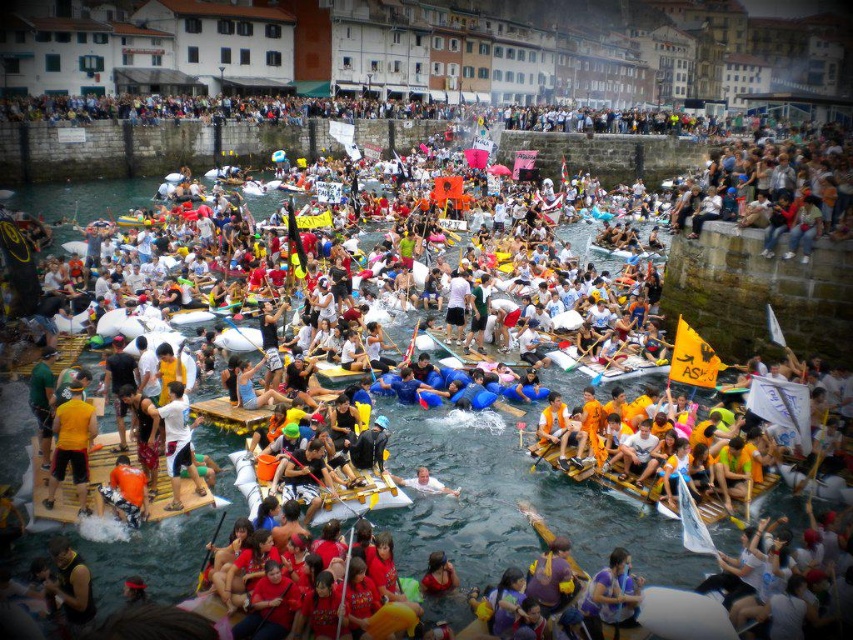
Is white matte shirt at center shorter than white fabric raft at center?

Yes.

Which is behind, point (165, 428) or point (416, 484)?

Positioned behind is point (416, 484).

This screenshot has width=853, height=640. I want to click on white matte shirt at center, so click(178, 444).

Between yellow fabric shirt at center and white fabric raft at center, which one has less height?

white fabric raft at center

Is yellow fabric shirt at center taller than white fabric raft at center?

Indeed, yellow fabric shirt at center has a greater height compared to white fabric raft at center.

Is point (77, 435) positioned before point (408, 484)?

Yes, it is in front of point (408, 484).

At what (x,y) coordinates should I click in order to perform the action: click on yellow fabric shirt at center. Please return your answer as a coordinate pair (x, y). This screenshot has height=640, width=853. Looking at the image, I should click on (73, 444).

Is point (103, 500) behind point (595, 333)?

No, it is not.

Which is in front, point (119, 490) or point (601, 342)?

Point (119, 490) is in front.

The image size is (853, 640). I want to click on orange life vest at center, so click(x=126, y=492).